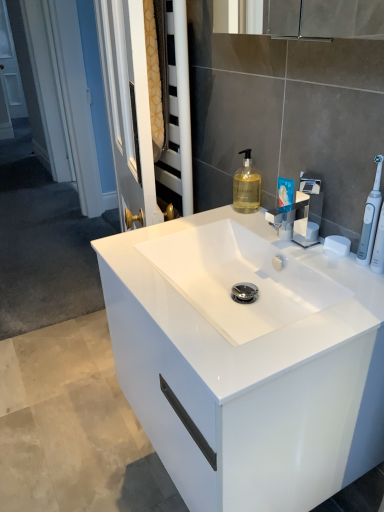
The width and height of the screenshot is (384, 512). In order to click on vacant space in between blue glossy toothpaste tube at upper right and translucent yellow liquid at center in this screenshot , I will do `click(260, 221)`.